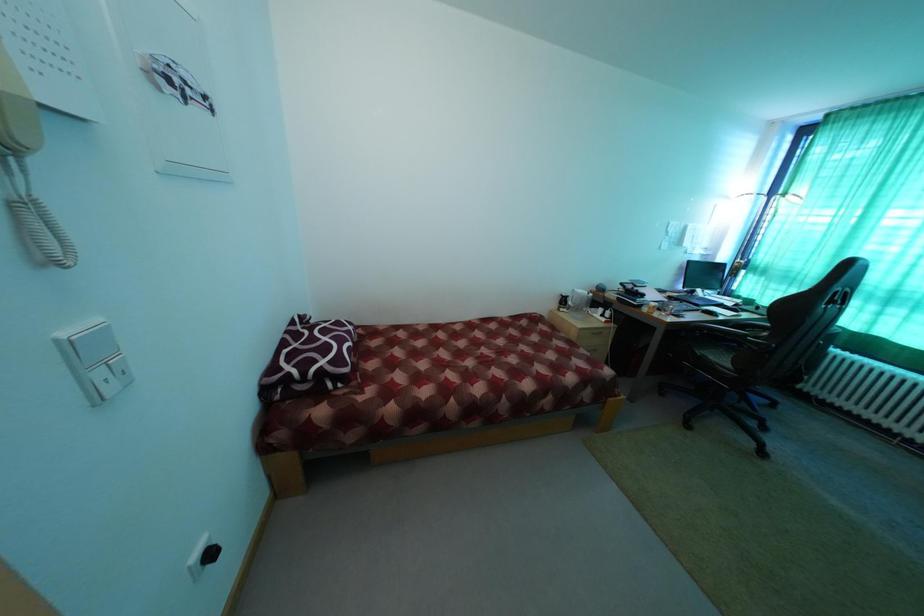
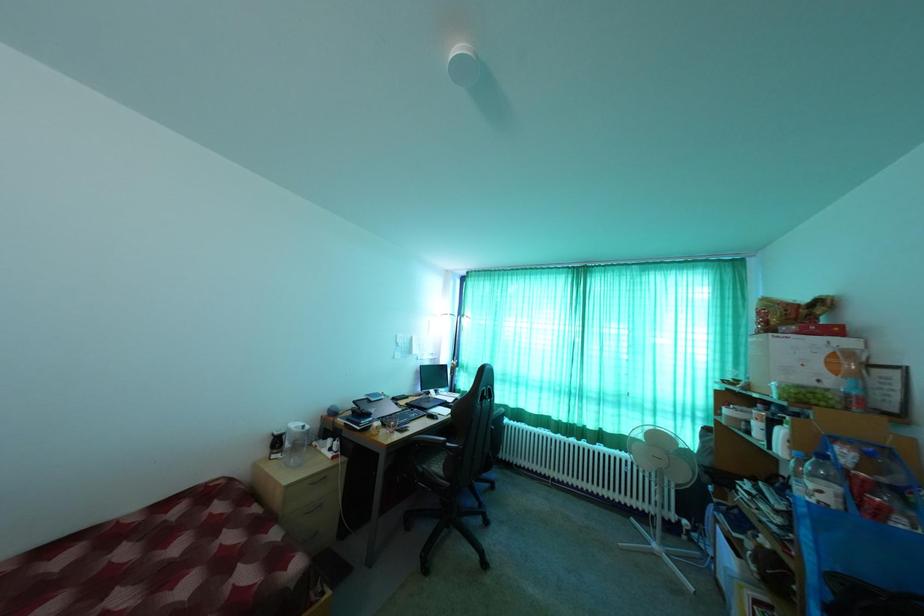
How did the camera likely rotate?

The camera's rotation is toward right-up.